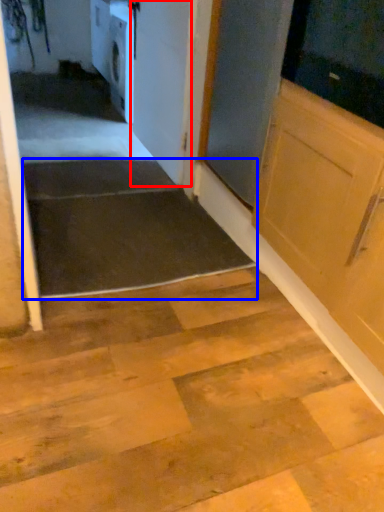
Question: Which point is closer to the camera, door (highlighted by a red box) or stairwell (highlighted by a blue box)?

Choices:
 (A) door
 (B) stairwell

Answer: (B)